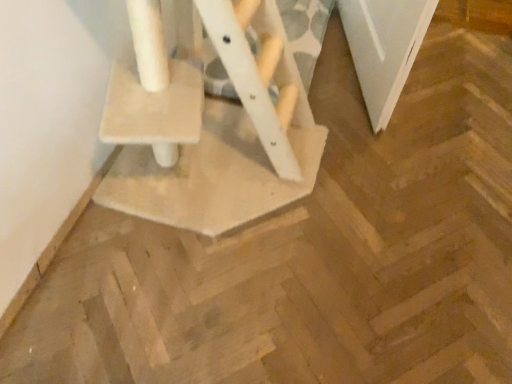
At what (x,y) coordinates should I click in order to perform the action: click on vacant space in front of beige textured cat tree at center. Please return your answer as a coordinate pair (x, y). This screenshot has height=384, width=512. Looking at the image, I should click on (197, 303).